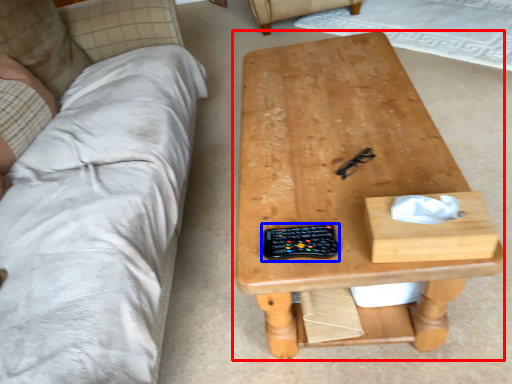
Question: Among these objects, which one is nearest to the camera, table (highlighted by a red box) or control (highlighted by a blue box)?

Choices:
 (A) table
 (B) control

Answer: (A)